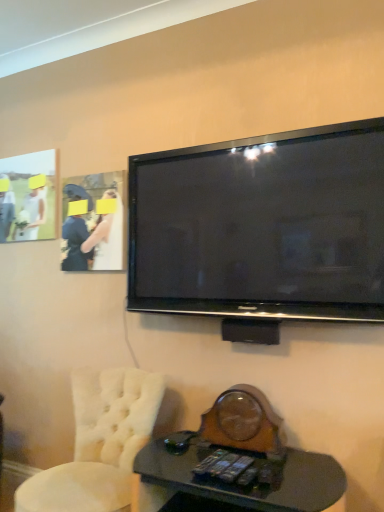
Question: Is matte white dress at upper left inside or outside of white tufted chair at lower left?

Choices:
 (A) inside
 (B) outside

Answer: (B)

Question: Is matte white dress at upper left bigger or smaller than white tufted chair at lower left?

Choices:
 (A) small
 (B) big

Answer: (A)

Question: Which object is positioned closest to the white tufted chair at lower left?

Choices:
 (A) matte white picture frame at upper left
 (B) matte white dress at upper left
 (C) black glossy flat-screen tv at upper center
 (D) black glass desk at lower center

Answer: (D)

Question: Estimate the real-world distances between objects in this image. Which object is closer to the matte white dress at upper left?

Choices:
 (A) black glass desk at lower center
 (B) white tufted chair at lower left
 (C) black glossy flat-screen tv at upper center
 (D) matte white picture frame at upper left

Answer: (D)